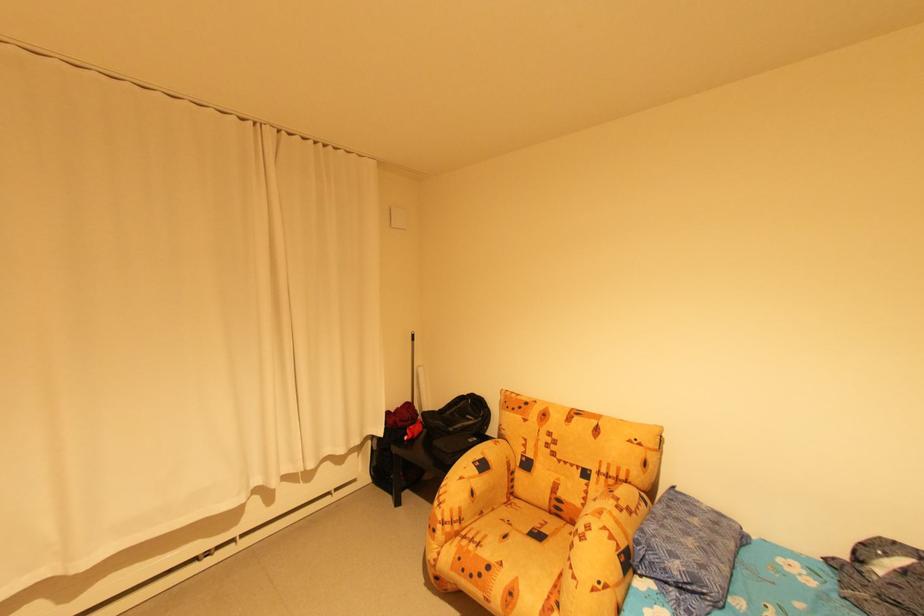
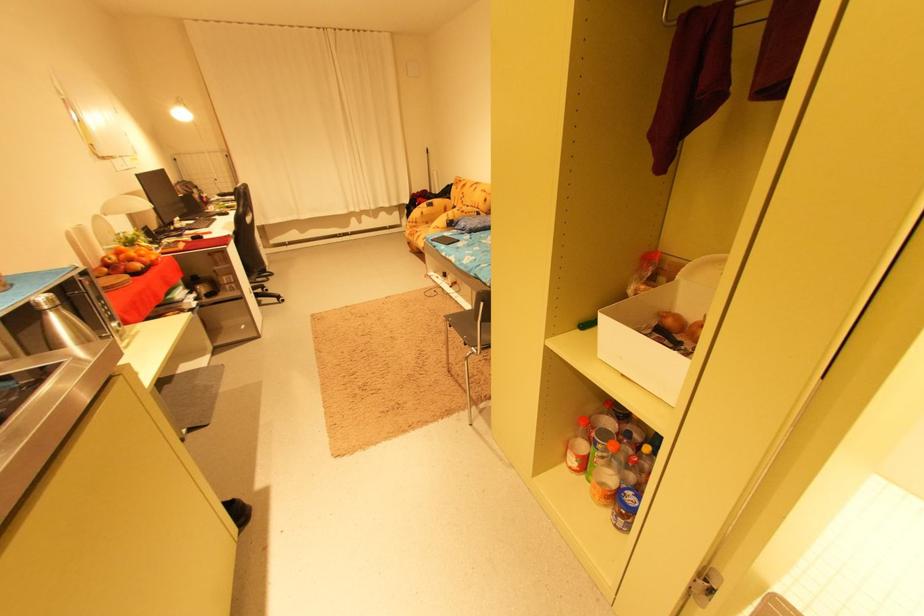
In the second image, find the point that corresponds to (x=636, y=548) in the first image.

(459, 221)